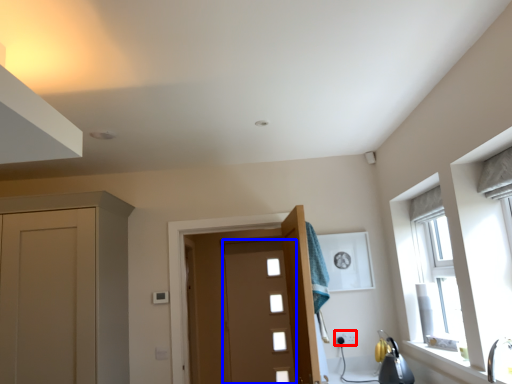
Question: Among these objects, which one is nearest to the camera, electric outlet (highlighted by a red box) or door (highlighted by a blue box)?

Choices:
 (A) electric outlet
 (B) door

Answer: (A)